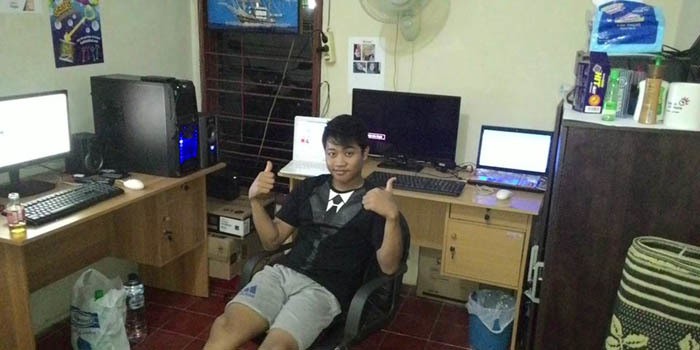
This screenshot has width=700, height=350. I want to click on desk, so click(158, 218).